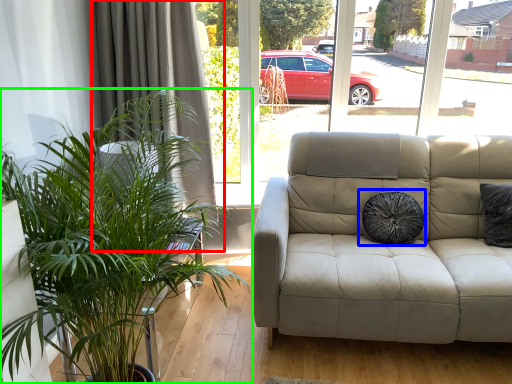
Question: Which is nearer to the curtain (highlighted by a red box)? pillow (highlighted by a blue box) or houseplant (highlighted by a green box).

Choices:
 (A) pillow
 (B) houseplant

Answer: (B)